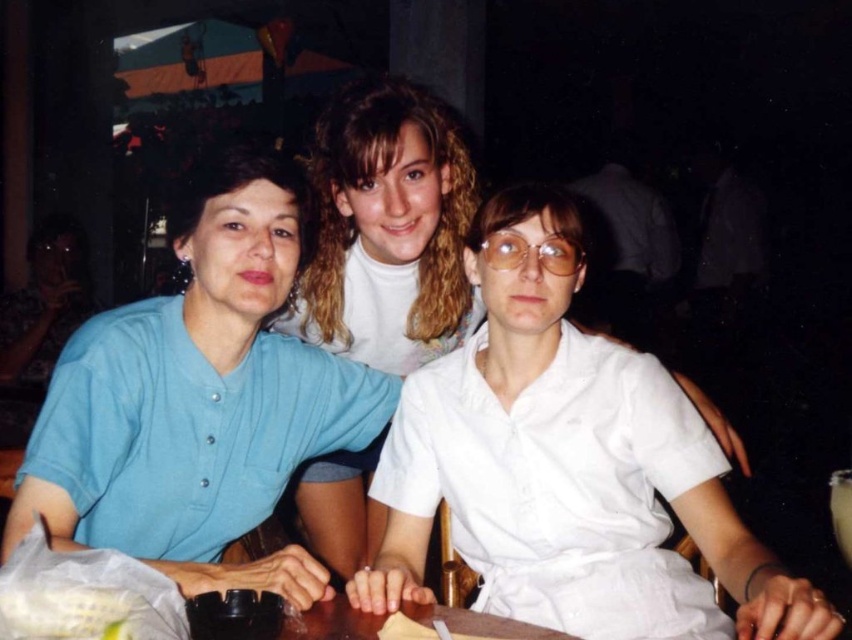
You are a photographer adjusting the camera settings for a group photo. You notice the matte blue shirt at left and the white matte shirt at center. Which person should you ask to sit slightly higher to ensure both are at the same eye level?

The matte blue shirt at left has a lesser height compared to white matte shirt at center, so you should ask the person wearing the matte blue shirt at left to sit slightly higher to match the eye level of the white matte shirt at center.

You are a photographer trying to capture a group photo of the matte blue shirt at left and the white matte shirt at center. Since you want to ensure both are centered in the frame, which direction should you move the camera to align them properly?

The matte blue shirt at left is to the left of the white matte shirt at center. To center both in the frame, move the camera slightly to the left so that the white matte shirt at center shifts towards the right and the matte blue shirt at left moves towards the center.